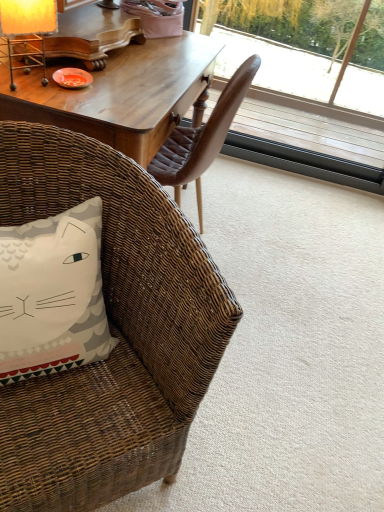
What do you see at coordinates (111, 332) in the screenshot? The image size is (384, 512). I see `woven brown chair at lower left` at bounding box center [111, 332].

Find the location of `transparent glass window at upper right`. transparent glass window at upper right is located at coordinates (303, 89).

Does matte yellow lampshade at upper left turn towards woven brown chair at lower left?

No, matte yellow lampshade at upper left is not facing towards woven brown chair at lower left.

From their relative heights in the image, would you say matte yellow lampshade at upper left is taller or shorter than woven brown chair at lower left?

matte yellow lampshade at upper left is shorter than woven brown chair at lower left.

Is matte yellow lampshade at upper left with woven brown chair at lower left?

No, matte yellow lampshade at upper left is not making contact with woven brown chair at lower left.

Can you confirm if woven brown chair at lower left is bigger than matte yellow lampshade at upper left?

Indeed, woven brown chair at lower left has a larger size compared to matte yellow lampshade at upper left.

How far apart are woven brown chair at lower left and matte yellow lampshade at upper left?

woven brown chair at lower left and matte yellow lampshade at upper left are 25.24 inches apart from each other.

What's the angular difference between woven brown chair at lower left and matte yellow lampshade at upper left's facing directions?

woven brown chair at lower left and matte yellow lampshade at upper left are facing 107 degrees away from each other.

The height and width of the screenshot is (512, 384). Identify the location of chair below the matte yellow lampshade at upper left (from the image's perspective). tap(111, 332).

Is transparent glass window at upper right at the back of white fabric pillow with cat design at lower left?

No.

Which object is closer to the camera, white fabric pillow with cat design at lower left or transparent glass window at upper right?

white fabric pillow with cat design at lower left is more forward.

Would you say white fabric pillow with cat design at lower left is outside transparent glass window at upper right?

That's correct, white fabric pillow with cat design at lower left is outside of transparent glass window at upper right.

Where is `window screen above the white fabric pillow with cat design at lower left (from the image's perspective)`? window screen above the white fabric pillow with cat design at lower left (from the image's perspective) is located at coordinates (303, 89).

From the image's perspective, is woven brown chair at lower left below transparent glass window at upper right?

Yes.

Which of these two, woven brown chair at lower left or transparent glass window at upper right, is thinner?

With smaller width is transparent glass window at upper right.

Does woven brown chair at lower left touch transparent glass window at upper right?

woven brown chair at lower left and transparent glass window at upper right are not in contact.

The image size is (384, 512). I want to click on chair located on the left of transparent glass window at upper right, so click(x=111, y=332).

Would you say white fabric pillow with cat design at lower left is a long distance from matte yellow lampshade at upper left?

No, there isn't a large distance between white fabric pillow with cat design at lower left and matte yellow lampshade at upper left.

In the image, is white fabric pillow with cat design at lower left positioned in front of or behind matte yellow lampshade at upper left?

Clearly, white fabric pillow with cat design at lower left is in front of matte yellow lampshade at upper left.

Considering the relative positions of white fabric pillow with cat design at lower left and matte yellow lampshade at upper left in the image provided, is white fabric pillow with cat design at lower left to the left or to the right of matte yellow lampshade at upper left?

From the image, it's evident that white fabric pillow with cat design at lower left is to the right of matte yellow lampshade at upper left.

Is white fabric pillow with cat design at lower left inside or outside of matte yellow lampshade at upper left?

white fabric pillow with cat design at lower left is located beyond the bounds of matte yellow lampshade at upper left.

From the image's perspective, is matte yellow lampshade at upper left above or below white fabric pillow with cat design at lower left?

matte yellow lampshade at upper left is above white fabric pillow with cat design at lower left.

Identify the location of table lamp positioned vertically above the white fabric pillow with cat design at lower left (from a real-world perspective). (27, 31).

Does matte yellow lampshade at upper left touch white fabric pillow with cat design at lower left?

No, matte yellow lampshade at upper left is not in contact with white fabric pillow with cat design at lower left.

In the scene shown: Considering the relative sizes of matte yellow lampshade at upper left and white fabric pillow with cat design at lower left in the image provided, is matte yellow lampshade at upper left bigger than white fabric pillow with cat design at lower left?

No, matte yellow lampshade at upper left is not bigger than white fabric pillow with cat design at lower left.

Is matte yellow lampshade at upper left facing away from transparent glass window at upper right?

No.

Considering the relative positions of matte yellow lampshade at upper left and transparent glass window at upper right in the image provided, is matte yellow lampshade at upper left to the left or to the right of transparent glass window at upper right?

matte yellow lampshade at upper left is positioned on transparent glass window at upper right's left side.

Considering the relative sizes of matte yellow lampshade at upper left and transparent glass window at upper right in the image provided, is matte yellow lampshade at upper left taller than transparent glass window at upper right?

No.

Which is behind, matte yellow lampshade at upper left or transparent glass window at upper right?

Positioned behind is transparent glass window at upper right.

Where is `table lamp behind the woven brown chair at lower left`? This screenshot has height=512, width=384. table lamp behind the woven brown chair at lower left is located at coordinates (27, 31).

Find the location of a particular element. This screenshot has height=512, width=384. chair in front of the matte yellow lampshade at upper left is located at coordinates (111, 332).

Looking at the image, which one is located further to woven brown chair at lower left, matte yellow lampshade at upper left or white fabric pillow with cat design at lower left?

The object further to woven brown chair at lower left is matte yellow lampshade at upper left.

Estimate the real-world distances between objects in this image. Which object is closer to matte yellow lampshade at upper left, transparent glass window at upper right or woven brown chair at lower left?

woven brown chair at lower left lies closer to matte yellow lampshade at upper left than the other object.

Looking at the image, which one is located closer to white fabric pillow with cat design at lower left, matte yellow lampshade at upper left or woven brown chair at lower left?

woven brown chair at lower left is positioned closer to the anchor white fabric pillow with cat design at lower left.

Based on their spatial positions, is woven brown chair at lower left or matte yellow lampshade at upper left further from transparent glass window at upper right?

matte yellow lampshade at upper left is further to transparent glass window at upper right.

Based on their spatial positions, is transparent glass window at upper right or white fabric pillow with cat design at lower left closer to woven brown chair at lower left?

The object closer to woven brown chair at lower left is white fabric pillow with cat design at lower left.

Which object lies nearer to the anchor point matte yellow lampshade at upper left, white fabric pillow with cat design at lower left or woven brown chair at lower left?

white fabric pillow with cat design at lower left lies closer to matte yellow lampshade at upper left than the other object.

Which object lies nearer to the anchor point matte yellow lampshade at upper left, woven brown chair at lower left or transparent glass window at upper right?

woven brown chair at lower left is positioned closer to the anchor matte yellow lampshade at upper left.

Based on their spatial positions, is transparent glass window at upper right or white fabric pillow with cat design at lower left closer to matte yellow lampshade at upper left?

The object closer to matte yellow lampshade at upper left is white fabric pillow with cat design at lower left.

Find the location of a particular element. table lamp positioned between white fabric pillow with cat design at lower left and transparent glass window at upper right from near to far is located at coordinates point(27,31).

Locate an element on the screen. The width and height of the screenshot is (384, 512). pillow between matte yellow lampshade at upper left and woven brown chair at lower left vertically is located at coordinates (52, 295).

This screenshot has height=512, width=384. Identify the location of table lamp between woven brown chair at lower left and transparent glass window at upper right along the z-axis. (27, 31).

This screenshot has width=384, height=512. Identify the location of pillow located between woven brown chair at lower left and transparent glass window at upper right in the depth direction. (52, 295).